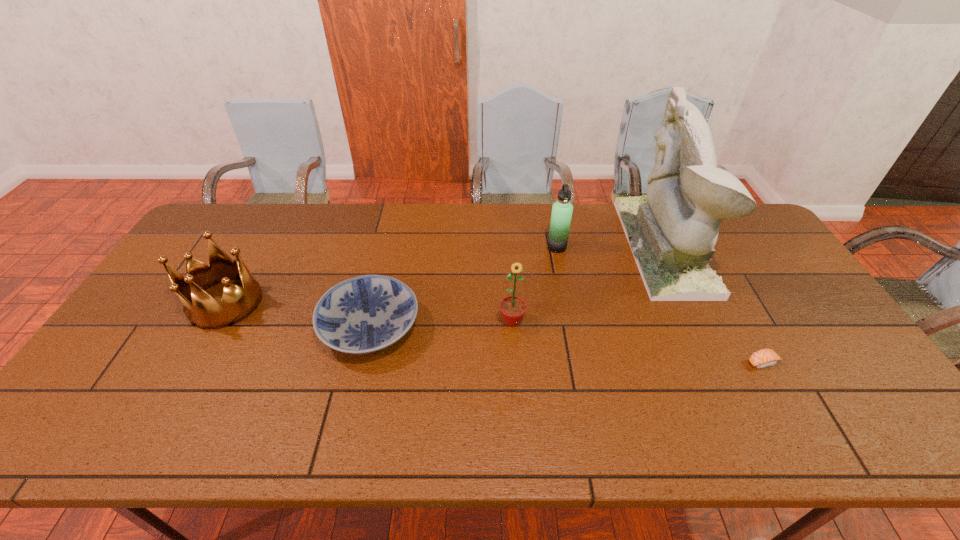
Where is `the tallest object`? the tallest object is located at coordinates (672, 231).

The height and width of the screenshot is (540, 960). What are the coordinates of `thermos bottle` in the screenshot? It's located at (562, 210).

Locate an element on the screen. the fourth object from right to left is located at coordinates pos(513,308).

Where is `the leftmost object`? The height and width of the screenshot is (540, 960). the leftmost object is located at coordinates [202, 310].

You are a GUI agent. You are given a task and a screenshot of the screen. Output one action in this format:
    pyautogui.click(x=<x>, y=<y>)
    Task: Click on the crown
    The image size is (960, 540).
    Given the screenshot: What is the action you would take?
    pyautogui.click(x=202, y=310)

This screenshot has height=540, width=960. Identify the location of plate. (364, 314).

Locate an element on the screen. The width and height of the screenshot is (960, 540). the fifth object from right to left is located at coordinates (364, 314).

Where is `the shortest object`? This screenshot has height=540, width=960. the shortest object is located at coordinates (763, 358).

At what (x,y) coordinates should I click in order to perform the action: click on vacant space located 0.120m on the base of the sculpture. Please return your answer as a coordinate pair (x, y). Looking at the image, I should click on (593, 247).

I want to click on vacant area situated on the base of the sculpture, so click(539, 247).